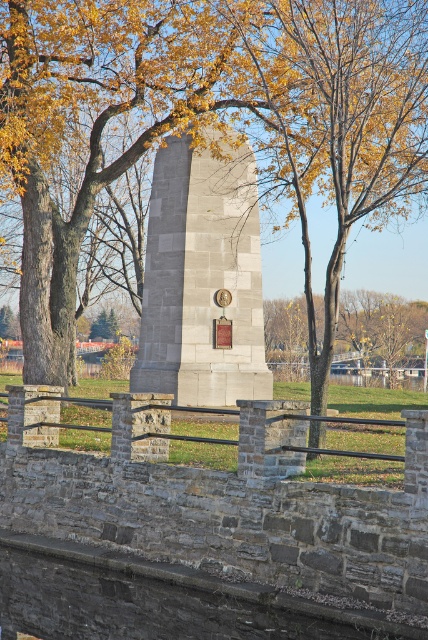
What do you see at coordinates (172, 124) in the screenshot? I see `brown leafy tree at center` at bounding box center [172, 124].

Does brown leafy tree at center have a lesser height compared to gray stone monument at center?

No.

This screenshot has width=428, height=640. Find the location of `brown leafy tree at center`. brown leafy tree at center is located at coordinates (172, 124).

What are the coordinates of `brown leafy tree at center` in the screenshot? It's located at (172, 124).

Does brown leafy tree at center have a greater height compared to gold metallic clock at center?

Indeed, brown leafy tree at center has a greater height compared to gold metallic clock at center.

Between brown leafy tree at center and gold metallic clock at center, which one appears on the right side from the viewer's perspective?

Positioned to the right is brown leafy tree at center.

Who is more forward, (79, 220) or (214, 296)?

Point (214, 296)

Locate an element on the screen. brown leafy tree at center is located at coordinates (172, 124).

Is gray stone monument at center to the left of gold metallic clock at center from the viewer's perspective?

No, gray stone monument at center is not to the left of gold metallic clock at center.

Does gray stone monument at center have a smaller size compared to gold metallic clock at center?

Incorrect, gray stone monument at center is not smaller in size than gold metallic clock at center.

Where is `gray stone monument at center`? gray stone monument at center is located at coordinates (202, 280).

Locate an element on the screen. The image size is (428, 640). gray stone monument at center is located at coordinates (202, 280).